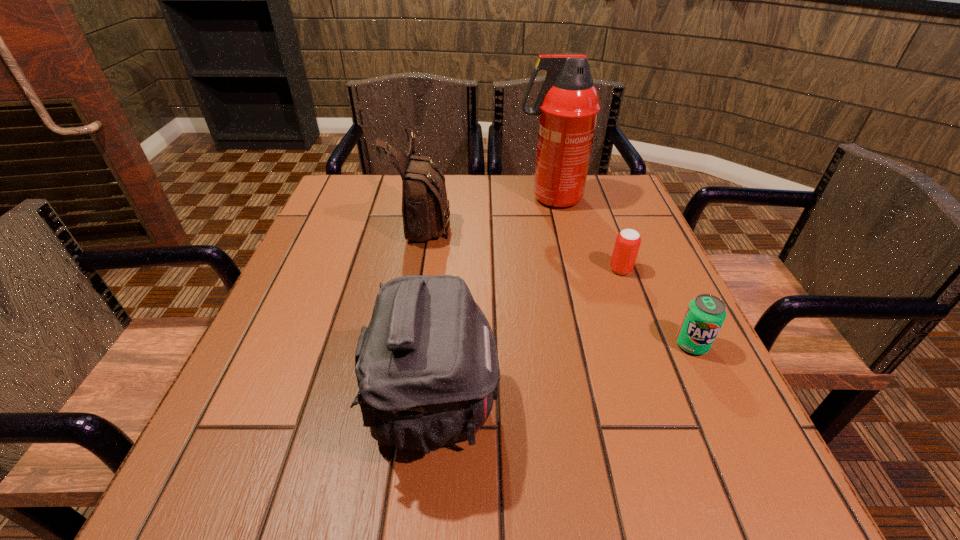
Find the location of a particular element. vacant area that lies between the nearer shoulder bag and the third object from right to left is located at coordinates (492, 302).

Find the location of a particular element. The width and height of the screenshot is (960, 540). vacant area between the tallest object and the nearer shoulder bag is located at coordinates point(492,302).

At what (x,y) coordinates should I click in order to perform the action: click on free space between the fire extinguisher and the farther shoulder bag. Please return your answer as a coordinate pair (x, y). Looking at the image, I should click on (487, 210).

The width and height of the screenshot is (960, 540). I want to click on vacant space in between the farther shoulder bag and the pop soda, so click(558, 283).

What are the coordinates of `free space between the tallest object and the second object from right to left` in the screenshot? It's located at (x=586, y=234).

Image resolution: width=960 pixels, height=540 pixels. In order to click on vacant space that's between the rightmost object and the fourth object from left to right in this screenshot , I will do `click(657, 307)`.

Find the location of a particular element. This screenshot has height=540, width=960. vacant region between the third nearest object and the nearer shoulder bag is located at coordinates (528, 339).

This screenshot has width=960, height=540. Identify the location of object that is the second closest to the rightmost object. (427, 368).

Point out which object is positioned as the third nearest to the second object from right to left. Please provide its 2D coordinates. Your answer should be formatted as a tuple, i.e. [(x, y)], where the tuple contains the x and y coordinates of a point satisfying the conditions above.

[(427, 368)]

The image size is (960, 540). I want to click on free space that satisfies the following two spatial constraints: 1. on the front-facing side of the pop soda; 2. on the open flap of the nearer shoulder bag, so click(x=721, y=407).